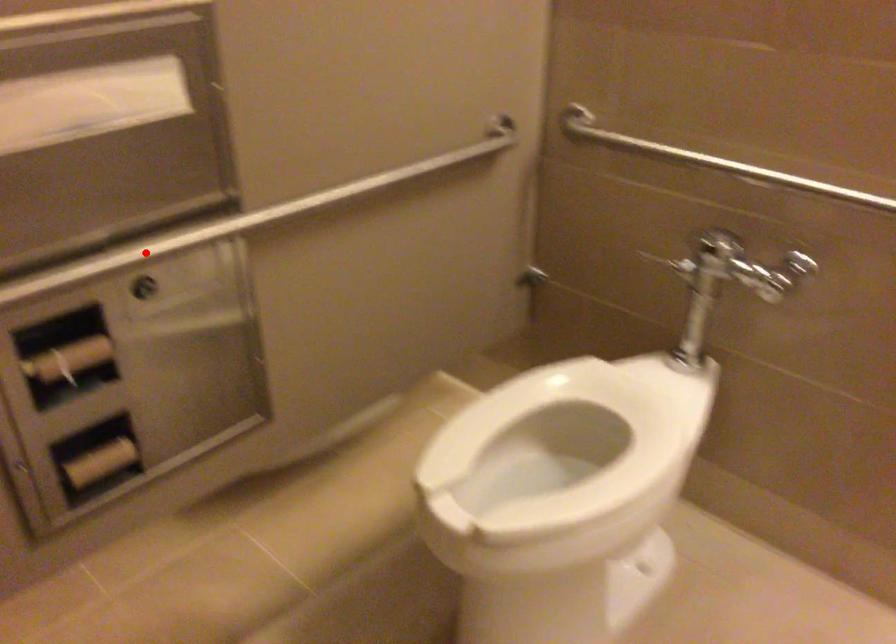
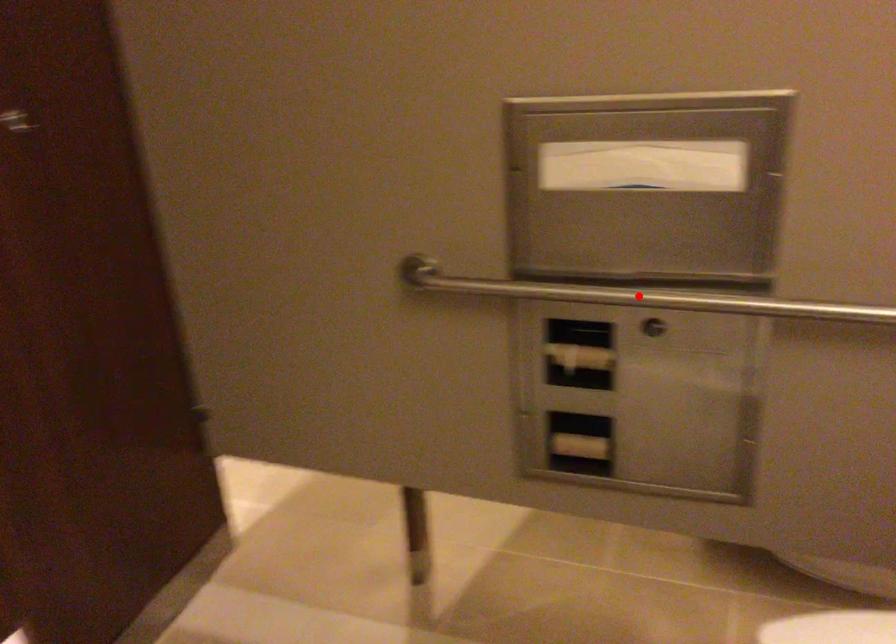
I am providing you with two images of the same scene from different viewpoints. A red point is marked on the first image and another point is marked on the second image. Is the red point in image1 aligned with the point shown in image2?

Yes